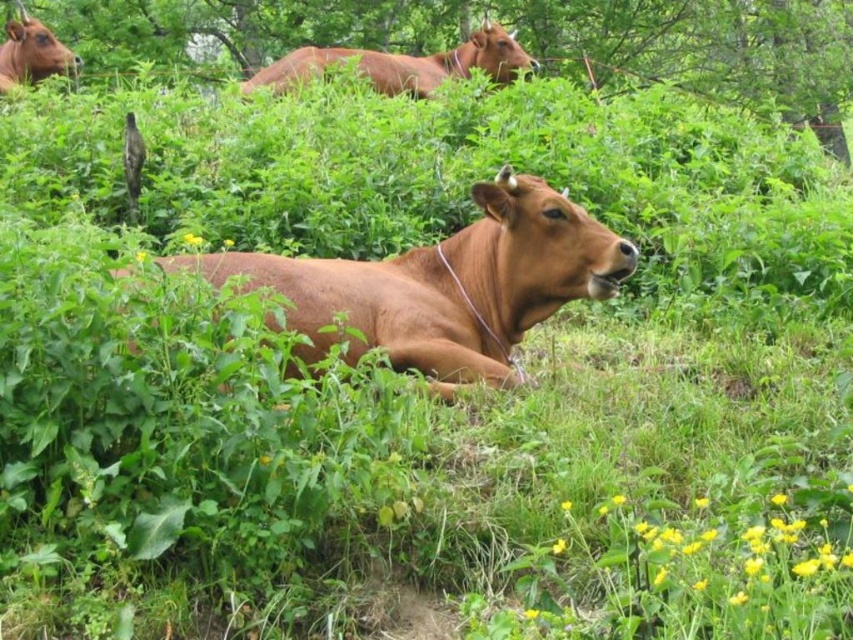
You are a photographer positioned in the field and want to capture a photo of the brown matte cow at center and the matte brown cow at upper left. Which cow will appear closer to the camera in the final photo?

The brown matte cow at center will appear closer to the camera in the final photo because it is positioned in front of the matte brown cow at upper left.

From the picture: You are a farmer checking on your cows in the pasture. You notice the brown matte cow at center and the matte brown cow at upper left. Which cow is located higher up in the image?

The matte brown cow at upper left is located higher up in the image because the brown matte cow at center is positioned under it.